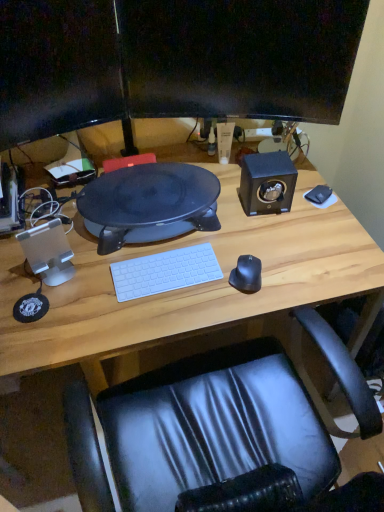
Where is `empty space that is to the right of black matte mouse at right`? This screenshot has width=384, height=512. empty space that is to the right of black matte mouse at right is located at coordinates (296, 279).